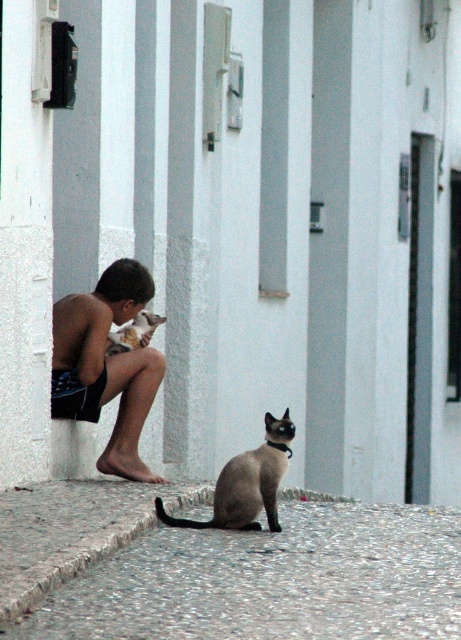
Question: Which object is closer to the camera taking this photo?

Choices:
 (A) brown fur cat at left
 (B) brown skin boy at left
 (C) smokey gray fur at lower center
 (D) gray gravel at lower center

Answer: (D)

Question: Estimate the real-world distances between objects in this image. Which object is closer to the gray gravel at lower center?

Choices:
 (A) gray concrete curb at lower left
 (B) brown fur cat at left
 (C) smokey gray fur at lower center

Answer: (A)

Question: Which point appears farthest from the camera in this image?

Choices:
 (A) (229, 492)
 (B) (84, 301)
 (C) (171, 618)
 (D) (135, 333)

Answer: (D)

Question: Is gray gravel at lower center smaller than smokey gray fur at lower center?

Choices:
 (A) no
 (B) yes

Answer: (A)

Question: Does smokey gray fur at lower center come behind brown fur cat at left?

Choices:
 (A) yes
 (B) no

Answer: (B)

Question: Is gray gravel at lower center behind brown fur cat at left?

Choices:
 (A) yes
 (B) no

Answer: (B)